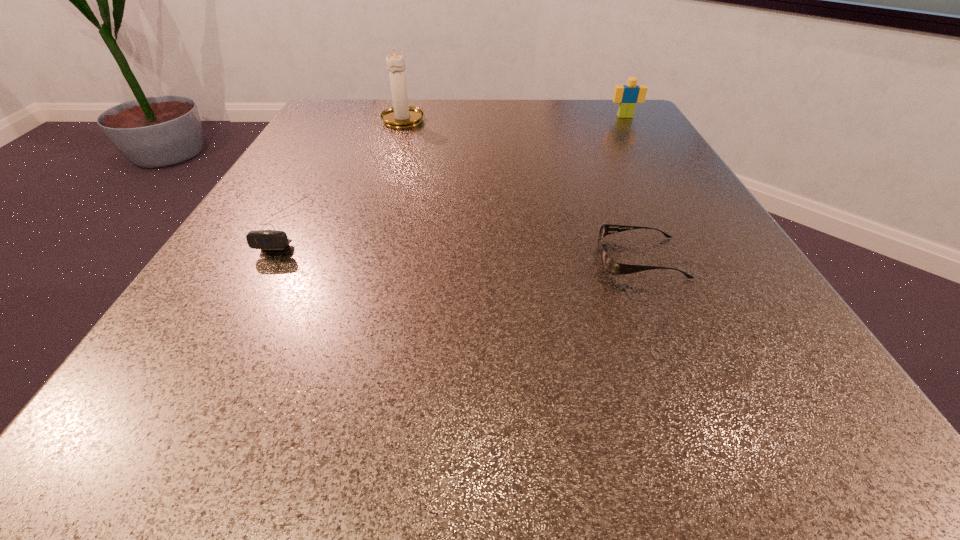
At what (x,y) coordinates should I click in order to perform the action: click on candle holder. Please return your answer as a coordinate pair (x, y). Looking at the image, I should click on (401, 115).

Identify the location of the second object from left to right. (401, 115).

Locate an element on the screen. the rightmost object is located at coordinates (627, 96).

Locate an element on the screen. Image resolution: width=960 pixels, height=540 pixels. the second tallest object is located at coordinates (627, 96).

Identify the location of webcam. The image size is (960, 540). (266, 240).

You are a GUI agent. You are given a task and a screenshot of the screen. Output one action in this format:
    pyautogui.click(x=<x>, y=<y>)
    Task: Click on the second shortest object
    The height and width of the screenshot is (540, 960).
    Given the screenshot: What is the action you would take?
    pyautogui.click(x=266, y=240)

In order to click on the shortest object in this screenshot , I will do `click(612, 267)`.

The width and height of the screenshot is (960, 540). In order to click on sunglasses in this screenshot , I will do `click(612, 267)`.

You are a GUI agent. You are given a task and a screenshot of the screen. Output one action in this format:
    pyautogui.click(x=<x>, y=<y>)
    Task: Click on the vacant space located 0.050m on the handle side of the second object from left to right
    The image size is (960, 540).
    Given the screenshot: What is the action you would take?
    pyautogui.click(x=409, y=100)

This screenshot has height=540, width=960. What are the coordinates of `vacant region located on the handle side of the second object from left to right` in the screenshot? It's located at (409, 99).